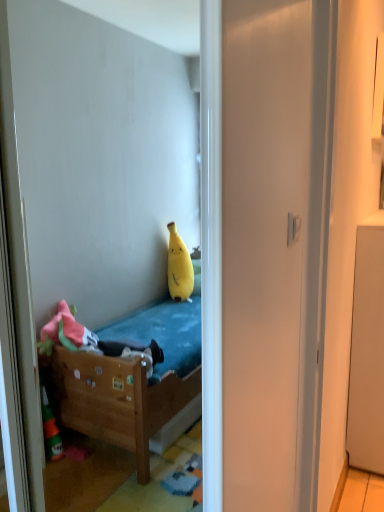
What do you see at coordinates (367, 350) in the screenshot?
I see `white matte cabinet at right` at bounding box center [367, 350].

You are a GUI agent. You are given a task and a screenshot of the screen. Output one action in this format:
    pyautogui.click(x=<x>, y=<y>)
    Task: Click on the white matte cabinet at right
    Image resolution: width=384 pixels, height=512 pixels.
    Given the screenshot: What is the action you would take?
    pyautogui.click(x=367, y=350)

Where is `white matte cabinet at right`? The height and width of the screenshot is (512, 384). white matte cabinet at right is located at coordinates (367, 350).